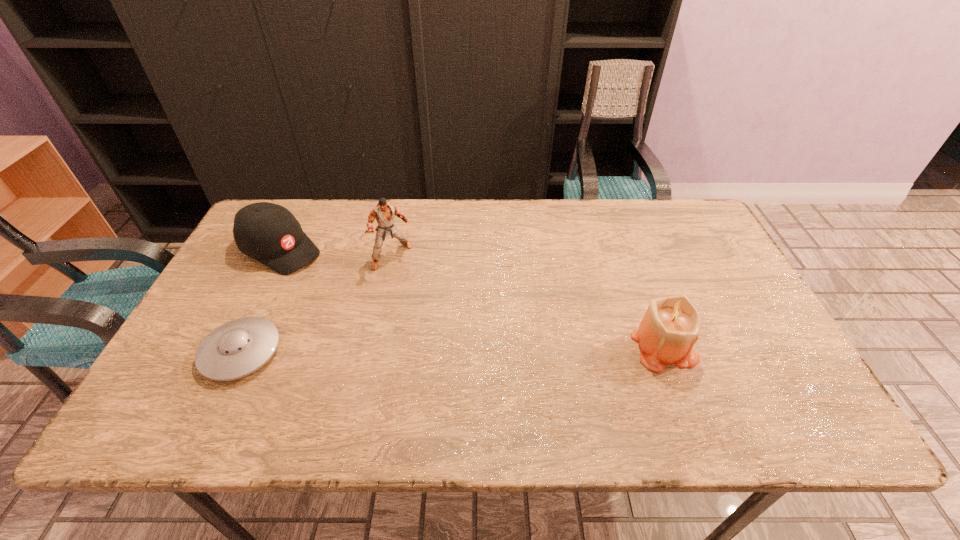
In order to click on free space located 0.250m with a logo on the front of the second shortest object in this screenshot , I will do `click(370, 300)`.

Locate an element on the screen. This screenshot has height=540, width=960. free space located with a logo on the front of the second shortest object is located at coordinates (351, 289).

Image resolution: width=960 pixels, height=540 pixels. Identify the location of free location located 0.070m with a logo on the front of the second shortest object. (324, 274).

The height and width of the screenshot is (540, 960). I want to click on puncher present at the far edge, so click(384, 213).

This screenshot has height=540, width=960. Find the location of `baseball cap at the far edge`. baseball cap at the far edge is located at coordinates (269, 233).

The height and width of the screenshot is (540, 960). I want to click on saucer that is positioned at the near edge, so click(x=237, y=348).

This screenshot has height=540, width=960. I want to click on candle positioned at the near edge, so coord(670,327).

This screenshot has height=540, width=960. What are the coordinates of `saucer that is positioned at the left edge` in the screenshot? It's located at (237, 348).

Where is `baseball cap located in the left edge section of the desktop`? baseball cap located in the left edge section of the desktop is located at coordinates [269, 233].

Identify the location of object present at the far left corner. The image size is (960, 540). (269, 233).